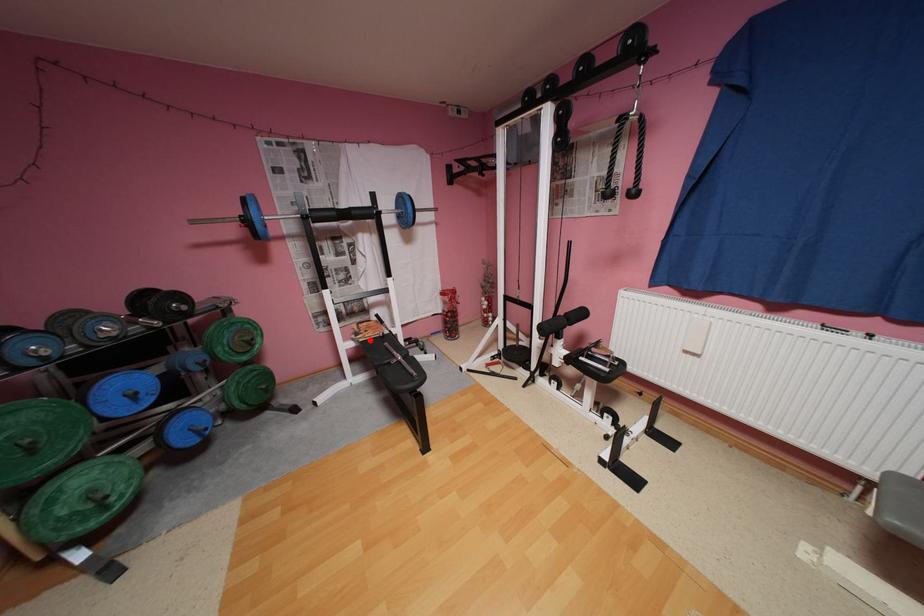
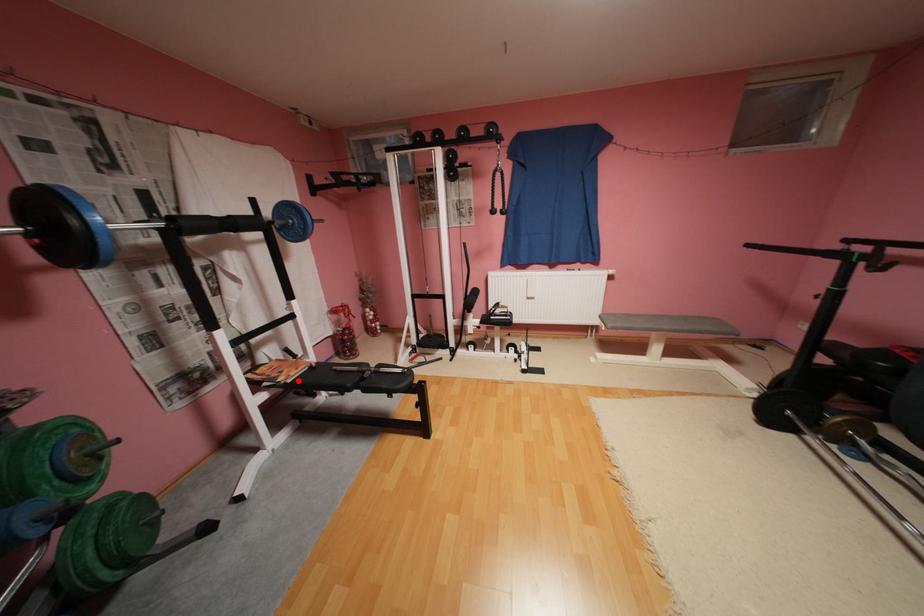
I am providing you with two images of the same scene from different viewpoints. A red point is marked on the first image and another point is marked on the second image. Is the red point in image1 aligned with the point shown in image2?

Yes